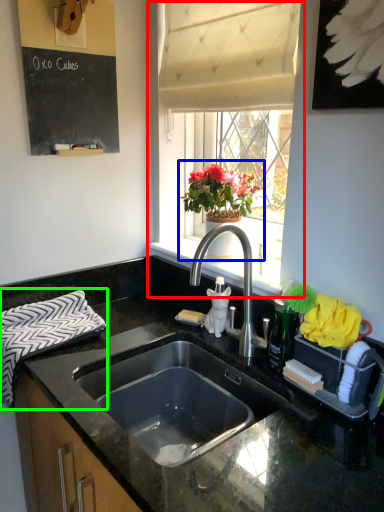
Question: Which object is the farthest from window (highlighted by a red box)? Choose among these: houseplant (highlighted by a blue box) or hand towel (highlighted by a green box).

Choices:
 (A) houseplant
 (B) hand towel

Answer: (B)